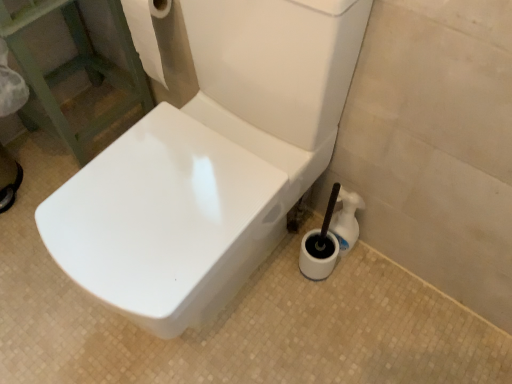
I want to click on free space in front of white glossy toilet brush at lower right, so click(x=348, y=303).